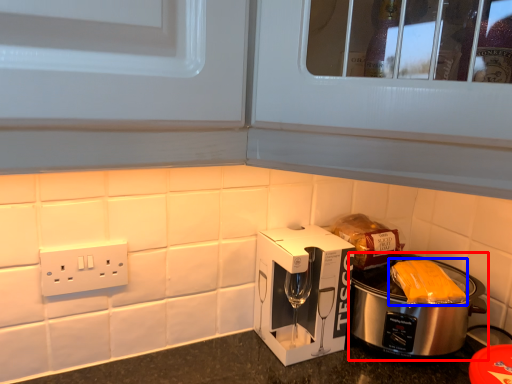
Question: Which of the following is the closest to the observer, slow cooker (highlighted by a red box) or food (highlighted by a blue box)?

Choices:
 (A) slow cooker
 (B) food

Answer: (A)